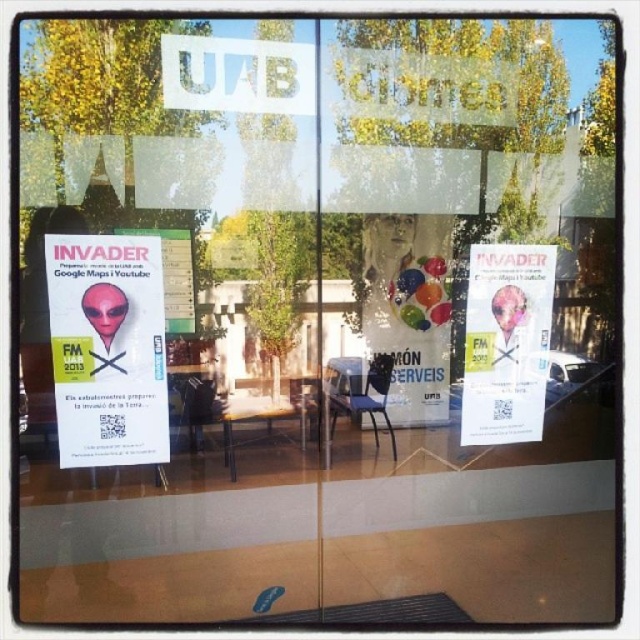
Does matte alien head at left have a smaller size compared to white paper poster at center?

Yes.

Does matte alien head at left have a lesser width compared to white paper poster at center?

Yes, matte alien head at left is thinner than white paper poster at center.

Is point (51, 324) more distant than point (532, 364)?

No, it is not.

Where is `matte alien head at left`? The width and height of the screenshot is (640, 640). matte alien head at left is located at coordinates (108, 348).